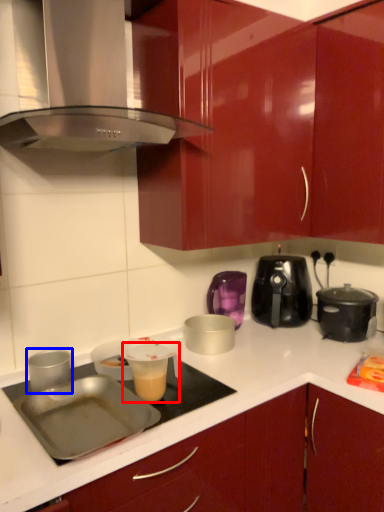
Question: Which object appears closest to the camera in this image, appliance (highlighted by a red box) or kitchen appliance (highlighted by a blue box)?

Choices:
 (A) appliance
 (B) kitchen appliance

Answer: (A)